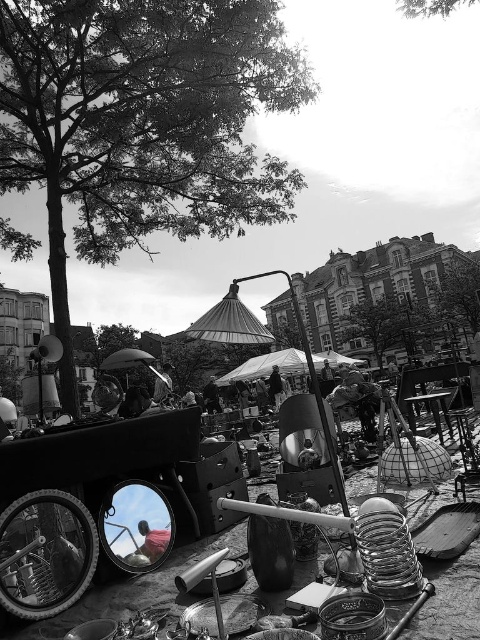
You are setting up a display at the flea market and want to place the metallic reflective mirror at center and the transparent fabric umbrella at center in a way that they don not overlap. Given their sizes, which object should you place closer to the front to ensure there is enough space between them?

Since the metallic reflective mirror at center occupies less space than the transparent fabric umbrella at center, you should place the transparent fabric umbrella at center closer to the front to allow sufficient space between them.

You are setting up a photo shoot and need to choose between the metallic reflective mirror at center and the wooden picnic table at center. Which object would you choose if you want the wider one for your setup?

The metallic reflective mirror at center is wider than the wooden picnic table at center, so you should choose the metallic reflective mirror at center for your photo shoot setup.